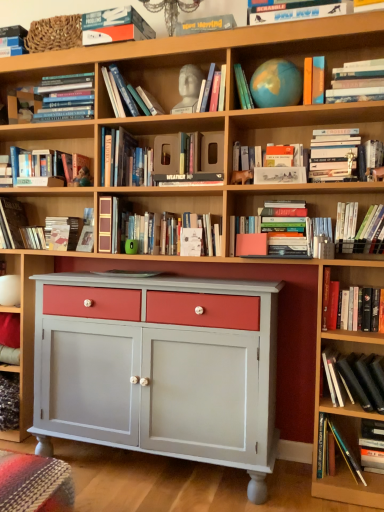
You are a GUI agent. You are given a task and a screenshot of the screen. Output one action in this format:
    pyautogui.click(x=<x>, y=<y>)
    Task: Click on the matte orange book at upper center, positioned as the second book in top-to-bottom order
    This screenshot has height=512, width=384.
    Given the screenshot: What is the action you would take?
    pyautogui.click(x=114, y=26)

Image resolution: width=384 pixels, height=512 pixels. What do you see at coordinates (333, 154) in the screenshot?
I see `hardcover book at upper right, the seventh book ordered from the bottom` at bounding box center [333, 154].

Locate an element on the screen. hardcover book at upper center, which is the ninth book in top-to-bottom order is located at coordinates (124, 160).

Find the location of `black matte book at lower right, placed as the third book when sorted from bottom to top`. black matte book at lower right, placed as the third book when sorted from bottom to top is located at coordinates (355, 379).

What do you see at coordinates (243, 88) in the screenshot?
I see `matte blue globe at upper center, which ranks as the eleventh book in bottom-to-top order` at bounding box center [243, 88].

Identify the location of hardcover books at upper right, which is counted as the fifth book, starting from the bottom. The image size is (384, 512). (359, 230).

Is matte blue globe at upper center, which ranks as the eleventh book in bottom-to-top order, aimed at hardcover book at lower right, positioned as the first book in bottom-to-top order?

No, matte blue globe at upper center, which ranks as the eleventh book in bottom-to-top order, is not aimed at hardcover book at lower right, positioned as the first book in bottom-to-top order.

Which of these two, matte blue globe at upper center, which is the 6th book from top to bottom, or hardcover book at lower right, positioned as the first book in bottom-to-top order, is smaller?

→ Smaller between the two is matte blue globe at upper center, which is the 6th book from top to bottom.

Between matte blue globe at upper center, which is the 6th book from top to bottom, and hardcover book at lower right, placed as the sixteenth book when sorted from top to bottom, which one appears on the right side from the viewer's perspective?

hardcover book at lower right, placed as the sixteenth book when sorted from top to bottom, is more to the right.

How much distance is there between matte blue globe at upper center, which is the 6th book from top to bottom, and hardcover book at lower right, positioned as the first book in bottom-to-top order?

5.34 feet.

Who is taller, hardcover book at lower right, placed as the sixteenth book when sorted from top to bottom, or black matte book at lower right, the fourteenth book viewed from the top?

black matte book at lower right, the fourteenth book viewed from the top, is taller.

From a real-world perspective, is hardcover book at lower right, positioned as the first book in bottom-to-top order, located higher than black matte book at lower right, placed as the third book when sorted from bottom to top?

No, from a real-world perspective, hardcover book at lower right, positioned as the first book in bottom-to-top order, is not over black matte book at lower right, placed as the third book when sorted from bottom to top

Could you tell me if hardcover book at lower right, placed as the sixteenth book when sorted from top to bottom, is turned towards black matte book at lower right, the fourteenth book viewed from the top?

No, hardcover book at lower right, placed as the sixteenth book when sorted from top to bottom, is not facing towards black matte book at lower right, the fourteenth book viewed from the top.

Is hardcover book at lower right, positioned as the first book in bottom-to-top order, not near black matte book at lower right, the fourteenth book viewed from the top?

No.

Does white marble bust at upper center, which appears as the 5th book when viewed from the top, have a lesser width compared to orange matte book at upper right, the 7th book when ordered from top to bottom?

Yes, white marble bust at upper center, which appears as the 5th book when viewed from the top, is thinner than orange matte book at upper right, the 7th book when ordered from top to bottom.

At what (x,y) coordinates should I click in order to perform the action: click on the 5th book behind the orange matte book at upper right, the 7th book when ordered from top to bottom. Please return your answer as a coordinate pair (x, y). The width and height of the screenshot is (384, 512). Looking at the image, I should click on (206, 93).

From a real-world perspective, is white marble bust at upper center, which appears as the 5th book when viewed from the top, physically above orange matte book at upper right, the 7th book when ordered from top to bottom?

Correct, in the physical world, white marble bust at upper center, which appears as the 5th book when viewed from the top, is higher than orange matte book at upper right, the 7th book when ordered from top to bottom.

Does white marble bust at upper center, which appears as the 5th book when viewed from the top, have a smaller size compared to orange matte book at upper right, the 7th book when ordered from top to bottom?

No, white marble bust at upper center, which appears as the 5th book when viewed from the top, is not smaller than orange matte book at upper right, the 7th book when ordered from top to bottom.

Considering the sizes of objects matte black book at upper left, the first book positioned from the top, and matte blue globe at upper center, which is the 6th book from top to bottom, in the image provided, who is bigger, matte black book at upper left, the first book positioned from the top, or matte blue globe at upper center, which is the 6th book from top to bottom,?

Bigger between the two is matte blue globe at upper center, which is the 6th book from top to bottom.

Does matte black book at upper left, the first book positioned from the top, have a greater width compared to matte blue globe at upper center, which is the 6th book from top to bottom?

Indeed, matte black book at upper left, the first book positioned from the top, has a greater width compared to matte blue globe at upper center, which is the 6th book from top to bottom.

From the image's perspective, which one is positioned higher, matte black book at upper left, which is counted as the 16th book, starting from the bottom, or matte blue globe at upper center, which is the 6th book from top to bottom?

From the image's view, matte black book at upper left, which is counted as the 16th book, starting from the bottom, is above.

From a real-world perspective, is matte black book at upper left, the first book positioned from the top, on top of matte blue globe at upper center, which ranks as the eleventh book in bottom-to-top order?

Yes, from a real-world perspective, matte black book at upper left, the first book positioned from the top, is over matte blue globe at upper center, which ranks as the eleventh book in bottom-to-top order

Choose the correct answer: Is white paper at center inside hardcover book at lower right, arranged as the second book when ordered from the bottom, or outside it?

white paper at center lies outside hardcover book at lower right, arranged as the second book when ordered from the bottom.

From a real-world perspective, who is located lower, white paper at center or hardcover book at lower right, arranged as the second book when ordered from the bottom?

hardcover book at lower right, arranged as the second book when ordered from the bottom.

Consider the image. Is white paper at center far from hardcover book at lower right, arranged as the second book when ordered from the bottom?

Yes, white paper at center is far from hardcover book at lower right, arranged as the second book when ordered from the bottom.

Is white paper at center aimed at hardcover book at lower right, arranged as the second book when ordered from the bottom?

No.

From a real-world perspective, count 7th books downward from the matte blue globe at upper center, which is the 6th book from top to bottom, and point to it. Please provide its 2D coordinates.

[(13, 220)]

Does hardcover book at left, which is the 6th book in bottom-to-top order, have a lesser height compared to matte blue globe at upper center, which is the 6th book from top to bottom?

In fact, hardcover book at left, which is the 6th book in bottom-to-top order, may be taller than matte blue globe at upper center, which is the 6th book from top to bottom.

Considering the positions of objects hardcover book at left, which is the 6th book in bottom-to-top order, and matte blue globe at upper center, which ranks as the eleventh book in bottom-to-top order, in the image provided, who is more to the right, hardcover book at left, which is the 6th book in bottom-to-top order, or matte blue globe at upper center, which ranks as the eleventh book in bottom-to-top order,?

From the viewer's perspective, matte blue globe at upper center, which ranks as the eleventh book in bottom-to-top order, appears more on the right side.

Is hardcover book at left, which is the 6th book in bottom-to-top order, turned away from matte blue globe at upper center, which is the 6th book from top to bottom?

No, hardcover book at left, which is the 6th book in bottom-to-top order,'s orientation is not away from matte blue globe at upper center, which is the 6th book from top to bottom.

Is hardcover book at upper left, the thirteenth book when ordered from bottom to top, bigger or smaller than hardcover book at upper center, which is the ninth book in top-to-bottom order?

Considering their sizes, hardcover book at upper left, the thirteenth book when ordered from bottom to top, takes up more space than hardcover book at upper center, which is the ninth book in top-to-bottom order.

Is hardcover book at upper left, which is the 4th book from top to bottom, taller than hardcover book at upper center, which is the ninth book in top-to-bottom order?

No.

Which object is positioned more to the left, hardcover book at upper left, which is the 4th book from top to bottom, or hardcover book at upper center, placed as the 8th book when sorted from bottom to top?

hardcover book at upper left, which is the 4th book from top to bottom.

Can you confirm if hardcover book at upper left, the thirteenth book when ordered from bottom to top, is thinner than hardcover book at upper center, which is the ninth book in top-to-bottom order?

No, hardcover book at upper left, the thirteenth book when ordered from bottom to top, is not thinner than hardcover book at upper center, which is the ninth book in top-to-bottom order.

The image size is (384, 512). What are the coordinates of `book that is the 11th object directly below the matte blue globe at upper center, which is the 6th book from top to bottom (from a real-world perspective)` in the screenshot? It's located at (372, 445).

Identify the location of the 2nd book directly above the hardcover book at lower right, positioned as the first book in bottom-to-top order (from a real-world perspective). (355, 379).

Considering their positions, is hardcover books at upper center, the fourteenth book in the bottom-to-top sequence, positioned closer to hardcover book at upper center, which is the ninth book in top-to-bottom order, than matte orange book at upper center, which appears as the fifteenth book when ordered from the bottom?

hardcover books at upper center, the fourteenth book in the bottom-to-top sequence, is positioned closer to the anchor hardcover book at upper center, which is the ninth book in top-to-bottom order.

Which object lies further to the anchor point hardcover books at upper right, which is counted as the fifth book, starting from the bottom, orange matte book at upper right, the 7th book when ordered from top to bottom, or white paper at center?

Based on the image, white paper at center appears to be further to hardcover books at upper right, which is counted as the fifth book, starting from the bottom.

Which object lies nearer to the anchor point matte orange book at upper center, positioned as the second book in top-to-bottom order, hardcover book at upper right, marked as the ninth book in a bottom-to-top arrangement, or hardcover books at upper right, which is counted as the fifth book, starting from the bottom?

hardcover book at upper right, marked as the ninth book in a bottom-to-top arrangement, is positioned closer to the anchor matte orange book at upper center, positioned as the second book in top-to-bottom order.

From the image, which object appears to be farther from hardcover book at left, which is the 6th book in bottom-to-top order, hardcover books at upper right, the 12th book when ordered from top to bottom, or matte black book at upper left, the first book positioned from the top?

Based on the image, hardcover books at upper right, the 12th book when ordered from top to bottom, appears to be further to hardcover book at left, which is the 6th book in bottom-to-top order.

Looking at the image, which one is located closer to black matte book at lower right, placed as the third book when sorted from bottom to top, hardcover book at lower right, placed as the sixteenth book when sorted from top to bottom, or white paper at center?

hardcover book at lower right, placed as the sixteenth book when sorted from top to bottom, lies closer to black matte book at lower right, placed as the third book when sorted from bottom to top, than the other object.

Looking at the image, which one is located closer to hardcover books at upper right, the 12th book when ordered from top to bottom, black matte book at lower right, placed as the third book when sorted from bottom to top, or matte black book at upper left, which is counted as the 16th book, starting from the bottom?

black matte book at lower right, placed as the third book when sorted from bottom to top, is positioned closer to the anchor hardcover books at upper right, the 12th book when ordered from top to bottom.

Looking at the image, which one is located further to white paper at center, hardcover book at left, which is the 6th book in bottom-to-top order, or white marble bust at upper center, which appears as the 5th book when viewed from the top?

The object further to white paper at center is hardcover book at left, which is the 6th book in bottom-to-top order.

Which object lies nearer to the anchor point matte black book at upper left, which is counted as the 16th book, starting from the bottom, white marble bust at upper center, which ranks as the 12th book in bottom-to-top order, or hardcover book at left, the eleventh book viewed from the top?

Based on the image, hardcover book at left, the eleventh book viewed from the top, appears to be nearer to matte black book at upper left, which is counted as the 16th book, starting from the bottom.

Identify the location of paperback book located between hardcover books at upper center, which is the 3th book from top to bottom, and hardcover book at upper right, marked as the ninth book in a bottom-to-top arrangement, in the left-right direction. (191, 241).

This screenshot has height=512, width=384. Find the location of `paperback book between hardcover book at upper right, marked as the ninth book in a bottom-to-top arrangement, and black matte book at lower right, the fourteenth book viewed from the top, from top to bottom`. paperback book between hardcover book at upper right, marked as the ninth book in a bottom-to-top arrangement, and black matte book at lower right, the fourteenth book viewed from the top, from top to bottom is located at coordinates (191, 241).

Identify the location of paperback book between white marble bust at upper center, which appears as the 5th book when viewed from the top, and hardcover books at right, which appears as the 13th book when viewed from the top, in the vertical direction. This screenshot has width=384, height=512. (191, 241).

Where is `paperback book between hardcover book at upper left, which is the 4th book from top to bottom, and hardcover book at lower right, which appears as the 15th book when viewed from the top, from top to bottom`? This screenshot has width=384, height=512. paperback book between hardcover book at upper left, which is the 4th book from top to bottom, and hardcover book at lower right, which appears as the 15th book when viewed from the top, from top to bottom is located at coordinates (191, 241).